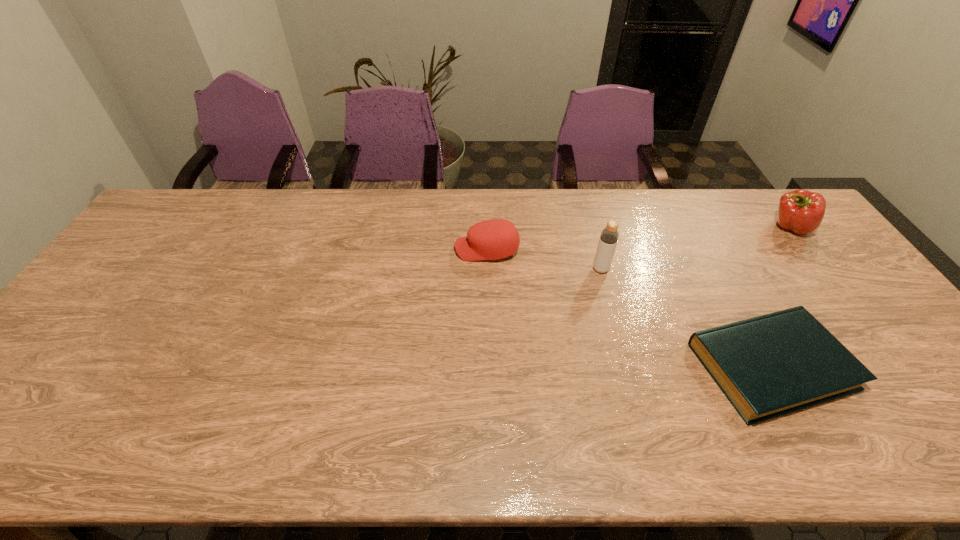
Where is `free space at the left edge`? free space at the left edge is located at coordinates (102, 328).

Image resolution: width=960 pixels, height=540 pixels. I want to click on free space at the right edge, so click(x=826, y=287).

The image size is (960, 540). What are the coordinates of `vacant space at the far left corner of the desktop` in the screenshot? It's located at (174, 232).

In the image, there is a desktop. Identify the location of vacant space at the far right corner. (770, 202).

Locate an element on the screen. vacant space that's between the pepper and the bottle is located at coordinates (695, 248).

You are a GUI agent. You are given a task and a screenshot of the screen. Output one action in this format:
    pyautogui.click(x=<x>, y=<y>)
    Task: Click on the free area in between the rightmost object and the book
    
    Given the screenshot: What is the action you would take?
    pyautogui.click(x=780, y=296)

At what (x,y) coordinates should I click in order to perform the action: click on vacant area that lies between the pepper and the third tallest object. Please return your answer as a coordinate pair (x, y). Looking at the image, I should click on (638, 238).

Where is `free point between the second shortest object and the rightmost object`? The height and width of the screenshot is (540, 960). free point between the second shortest object and the rightmost object is located at coordinates (638, 238).

The width and height of the screenshot is (960, 540). I want to click on free space between the tallest object and the cap, so click(543, 259).

At what (x,y) coordinates should I click in order to perform the action: click on vacant area between the third object from right to left and the pepper. Please return your answer as a coordinate pair (x, y). Looking at the image, I should click on (695, 248).